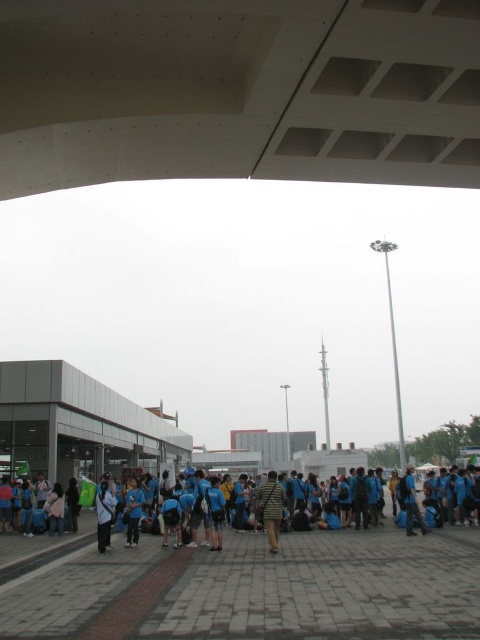
You are a photographer trying to capture a group photo of the blue fabric shirt at center and the striped fabric shirt at center. If you want to ensure both shirts are fully visible in the frame, which shirt should you focus on to avoid cropping?

The blue fabric shirt at center is wider than the striped fabric shirt at center, so focusing on the blue fabric shirt at center ensures the entire width of both shirts will be captured without cropping.

You are a photographer trying to capture a group photo of the people in the scene. You notice two individuals wearing a striped fabric shirt at center and a dark blue shirt at center. To ensure both are in the frame, should you adjust your camera to the left or right?

The striped fabric shirt at center is to the right of the dark blue shirt at center, so you should adjust your camera to the right to include both individuals in the frame.